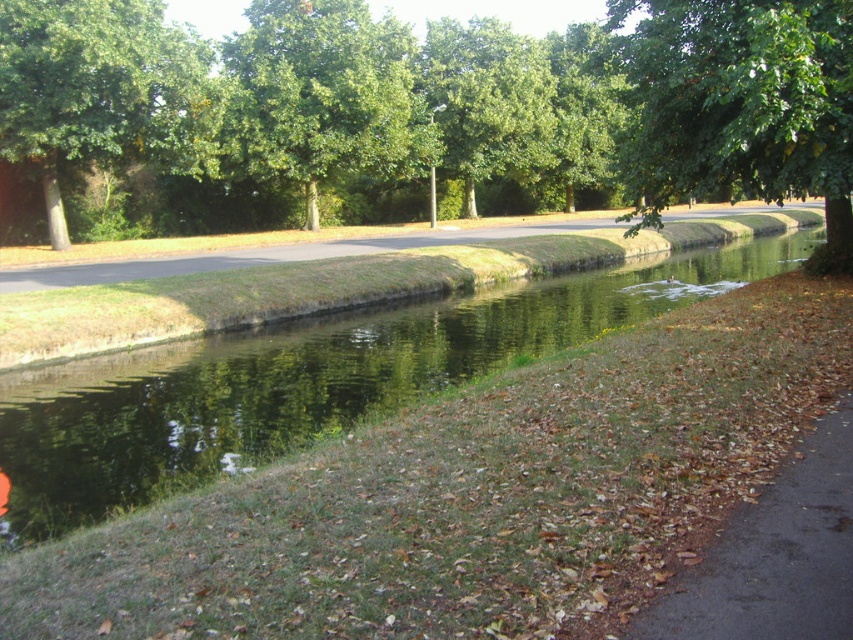
Based on the photo, you are a photographer planning to capture the green grassy river at center and the green leafy tree at upper center in a single frame. Based on their sizes, which one would appear larger in the photo?

The green leafy tree at upper center would appear larger in the photo because it is bigger in size compared to the green grassy river at center.